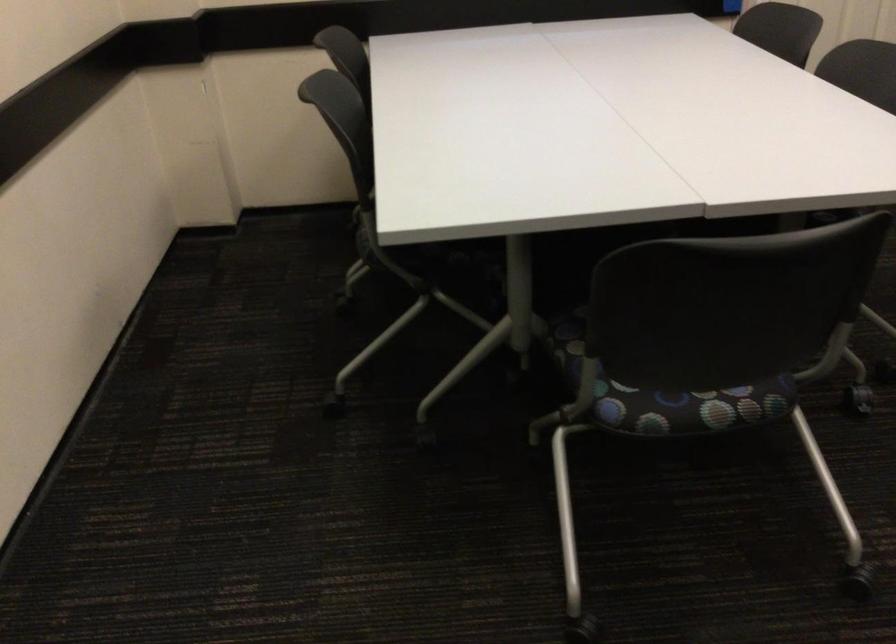
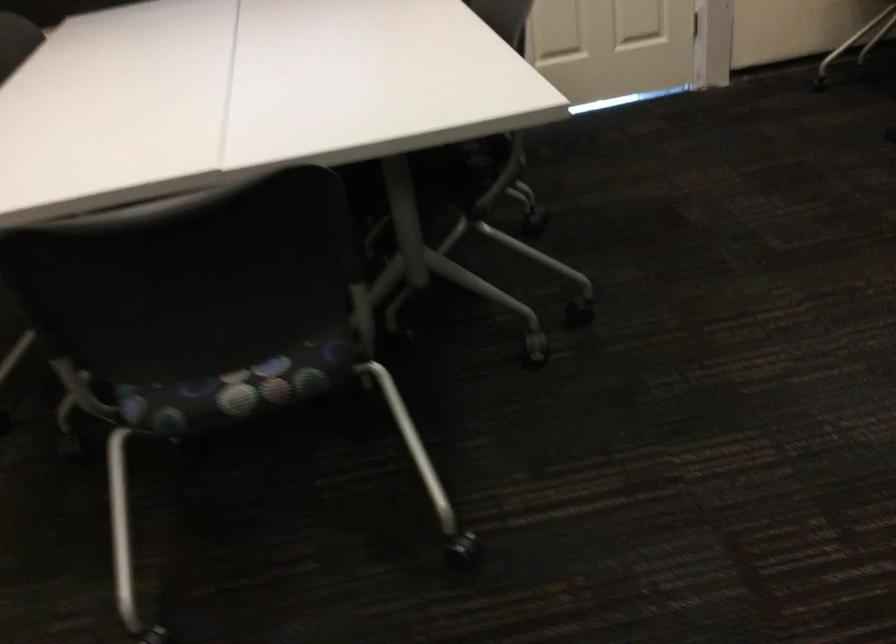
Where in the second image is the point corresponding to (x=707, y=404) from the first image?

(234, 389)